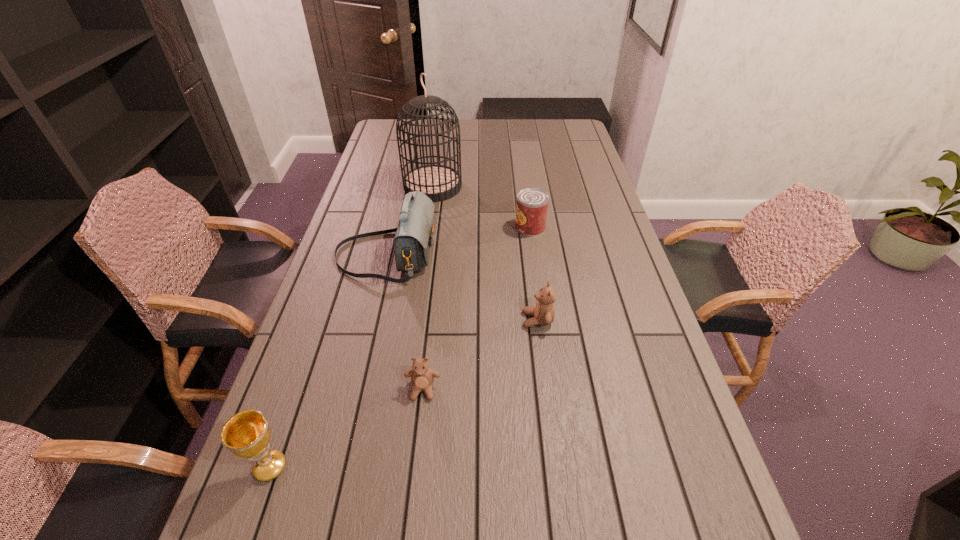
What are the coordinates of `free point that keeps the teddy bears evenly spaced on the right` in the screenshot? It's located at (625, 266).